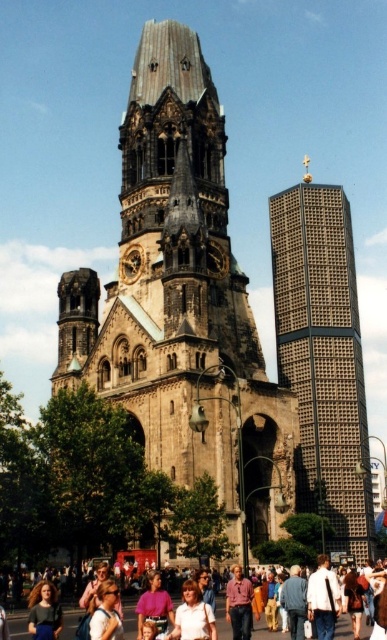
Can you confirm if light pink fabric shirt at center is bigger than matte purple blouse at center?

No.

Is point (181, 605) closer to camera compared to point (167, 602)?

That is True.

Measure the distance between point (214, 636) and camera.

38.53 meters

This screenshot has width=387, height=640. In order to click on light pink fabric shirt at center in this screenshot , I will do `click(193, 616)`.

Does white cotton shirt at center have a larger size compared to blonde hair at center?

Indeed, white cotton shirt at center has a larger size compared to blonde hair at center.

Does white cotton shirt at center have a greater height compared to blonde hair at center?

Yes.

Find the location of a particular element. white cotton shirt at center is located at coordinates (323, 598).

Which is above, white cotton shirt at center or pink cotton shirt at center?

white cotton shirt at center is above.

Does white cotton shirt at center have a lesser width compared to pink cotton shirt at center?

No.

Is point (327, 611) farther from camera compared to point (227, 604)?

No, (327, 611) is in front of (227, 604).

Find the location of a particular element. This screenshot has width=387, height=640. white cotton shirt at center is located at coordinates (323, 598).